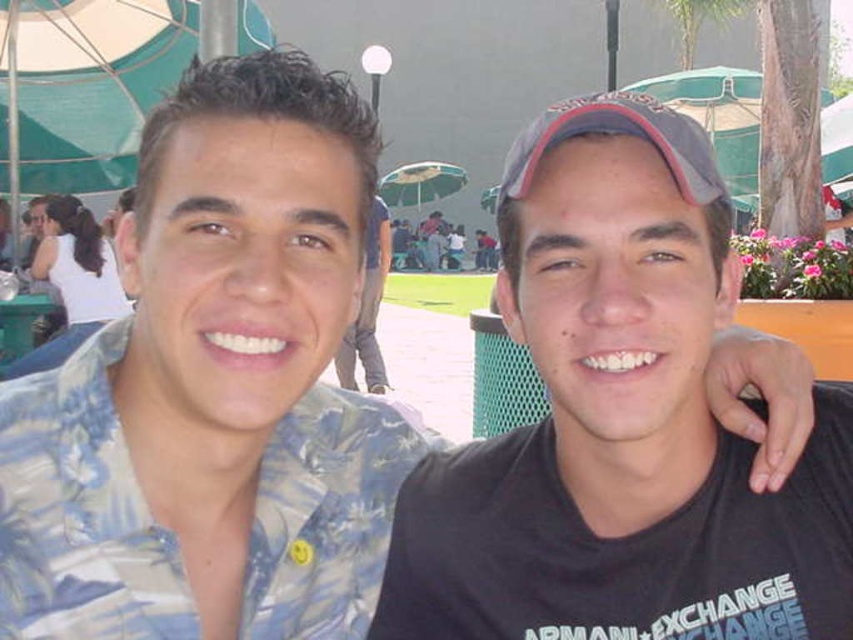
Does black matte cap at center have a greater width compared to matte blue shirt at center?

Incorrect, black matte cap at center's width does not surpass matte blue shirt at center's.

Does point (666, 236) come closer to viewer compared to point (379, 216)?

Yes, it is.

Which is in front, point (717, 300) or point (340, 364)?

Point (717, 300) is in front.

Find the location of a particular element. Image resolution: width=853 pixels, height=640 pixels. black matte cap at center is located at coordinates (619, 422).